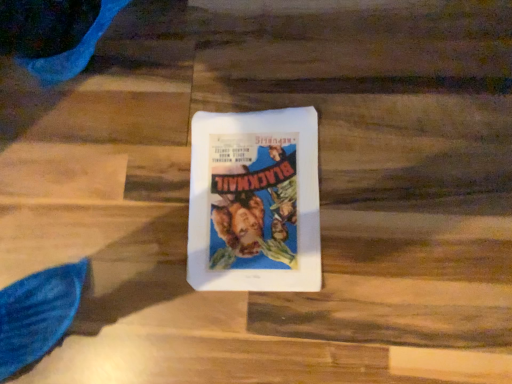
Where is `free space above white paper book at center (from a real-world perspective)`? This screenshot has height=384, width=512. free space above white paper book at center (from a real-world perspective) is located at coordinates (251, 193).